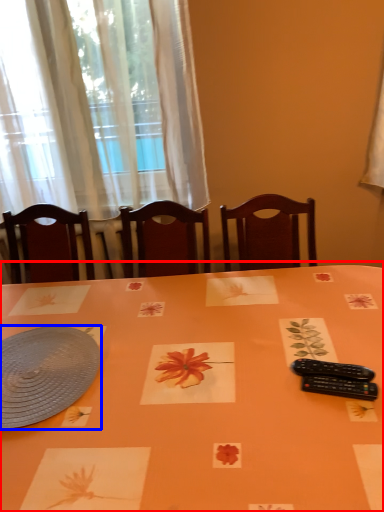
Question: Which point is closer to the camera, table (highlighted by a red box) or platter (highlighted by a blue box)?

Choices:
 (A) table
 (B) platter

Answer: (A)